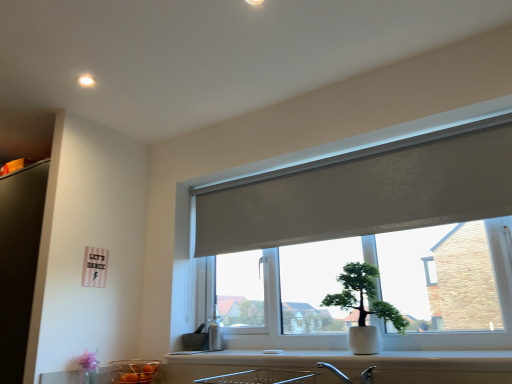
Image resolution: width=512 pixels, height=384 pixels. I want to click on white ceramic pot at center, so click(364, 307).

Describe the element at coordinates (364, 307) in the screenshot. This screenshot has width=512, height=384. I see `white ceramic pot at center` at that location.

This screenshot has height=384, width=512. I want to click on white ceramic pot at center, so click(x=364, y=307).

Is matte gray roller blind at center located within translucent glass bowl at lower left?

Definitely not — matte gray roller blind at center is not inside translucent glass bowl at lower left.

Looking at the image, does translucent glass bowl at lower left seem bigger or smaller compared to matte gray roller blind at center?

Clearly, translucent glass bowl at lower left is smaller in size than matte gray roller blind at center.

Consider the image. Is translucent glass bowl at lower left looking in the opposite direction of matte gray roller blind at center?

No, matte gray roller blind at center is not at the back of translucent glass bowl at lower left.

What's the angular difference between translucent glass bowl at lower left and matte gray roller blind at center's facing directions?

translucent glass bowl at lower left and matte gray roller blind at center are facing 0.0002 degrees away from each other.

Is matte gray roller blind at center at the right side of translucent glass bowl at lower left?

Indeed, matte gray roller blind at center is positioned on the right side of translucent glass bowl at lower left.

Where is `window in front of the translucent glass bowl at lower left`? window in front of the translucent glass bowl at lower left is located at coordinates (365, 195).

Is matte gray roller blind at center taller or shorter than translucent glass bowl at lower left?

Considering their sizes, matte gray roller blind at center has more height than translucent glass bowl at lower left.

From the image's perspective, which is below, matte gray roller blind at center or white glossy counter top at lower center?

white glossy counter top at lower center appears lower in the image.

How many degrees apart are the facing directions of matte gray roller blind at center and white glossy counter top at lower center?

The angle between the facing direction of matte gray roller blind at center and the facing direction of white glossy counter top at lower center is 0.781 degrees.

Considering the sizes of matte gray roller blind at center and white glossy counter top at lower center in the image, is matte gray roller blind at center wider or thinner than white glossy counter top at lower center?

Considering their sizes, matte gray roller blind at center looks slimmer than white glossy counter top at lower center.

Is point (421, 374) positioned after point (294, 180)?

No, (421, 374) is closer to viewer.

Can you confirm if white glossy counter top at lower center is wider than matte gray roller blind at center?

Yes.

Is white glossy counter top at lower center not close to matte gray roller blind at center?

No, white glossy counter top at lower center is not far away from matte gray roller blind at center.

In the image, there is a matte gray roller blind at center. In order to click on counter top below it (from a real-world perspective) in this screenshot , I will do `click(353, 365)`.

In the image, is white ceramic pot at center positioned in front of or behind white glossy counter top at lower center?

Clearly, white ceramic pot at center is behind white glossy counter top at lower center.

Is white glossy counter top at lower center a part of white ceramic pot at center?

No.

How many degrees apart are the facing directions of white ceramic pot at center and white glossy counter top at lower center?

white ceramic pot at center and white glossy counter top at lower center are facing 0.781 degrees away from each other.

Is white ceramic pot at center directly adjacent to matte gray roller blind at center?

They are not placed beside each other.

How different are the orientations of white ceramic pot at center and matte gray roller blind at center in degrees?

The facing directions of white ceramic pot at center and matte gray roller blind at center are 0.000109 degrees apart.

In terms of size, does white ceramic pot at center appear bigger or smaller than matte gray roller blind at center?

In the image, white ceramic pot at center appears to be smaller than matte gray roller blind at center.

From a real-world perspective, who is located lower, white ceramic pot at center or matte gray roller blind at center?

From a 3D spatial view, white ceramic pot at center is below.

Where is `counter top on the left of white ceramic pot at center`? The width and height of the screenshot is (512, 384). counter top on the left of white ceramic pot at center is located at coordinates (353, 365).

Does white glossy counter top at lower center appear on the left side of white ceramic pot at center?

Yes.

How far apart are white glossy counter top at lower center and white ceramic pot at center?

white glossy counter top at lower center is 27.37 centimeters from white ceramic pot at center.

Considering the positions of point (297, 364) and point (361, 283), is point (297, 364) closer or farther from the camera than point (361, 283)?

Point (297, 364) is positioned farther from the camera compared to point (361, 283).

At what (x,y) coordinates should I click in order to perform the action: click on window in front of the translucent glass bowl at lower left. Please return your answer as a coordinate pair (x, y). The height and width of the screenshot is (384, 512). Looking at the image, I should click on (365, 195).

Locate an element on the screen. This screenshot has height=384, width=512. glass bowl below the matte gray roller blind at center (from the image's perspective) is located at coordinates (133, 371).

Which object lies nearer to the anchor point matte gray roller blind at center, white ceramic pot at center or translucent glass bowl at lower left?

white ceramic pot at center.

Which object lies further to the anchor point white ceramic pot at center, white glossy counter top at lower center or matte gray roller blind at center?

Based on the image, matte gray roller blind at center appears to be further to white ceramic pot at center.

Estimate the real-world distances between objects in this image. Which object is closer to white ceramic pot at center, matte gray roller blind at center or translucent glass bowl at lower left?

Among the two, matte gray roller blind at center is located nearer to white ceramic pot at center.

Based on their spatial positions, is translucent glass bowl at lower left or matte gray roller blind at center closer to white ceramic pot at center?

matte gray roller blind at center.

Looking at the image, which one is located further to translucent glass bowl at lower left, matte gray roller blind at center or white glossy counter top at lower center?

Based on the image, matte gray roller blind at center appears to be further to translucent glass bowl at lower left.

When comparing their distances from matte gray roller blind at center, does translucent glass bowl at lower left or white glossy counter top at lower center seem closer?

white glossy counter top at lower center is closer to matte gray roller blind at center.

From the picture: Estimate the real-world distances between objects in this image. Which object is further from white ceramic pot at center, translucent glass bowl at lower left or white glossy counter top at lower center?

translucent glass bowl at lower left is further to white ceramic pot at center.

When comparing their distances from white glossy counter top at lower center, does white ceramic pot at center or matte gray roller blind at center seem closer?

Among the two, white ceramic pot at center is located nearer to white glossy counter top at lower center.

Locate an element on the screen. Image resolution: width=512 pixels, height=384 pixels. counter top located between translucent glass bowl at lower left and white ceramic pot at center in the left-right direction is located at coordinates (353, 365).

Locate an element on the screen. The image size is (512, 384). counter top situated between translucent glass bowl at lower left and matte gray roller blind at center from left to right is located at coordinates click(x=353, y=365).

Identify the location of houseplant between matte gray roller blind at center and white glossy counter top at lower center vertically. (364, 307).

Image resolution: width=512 pixels, height=384 pixels. In order to click on window situated between translucent glass bowl at lower left and white ceramic pot at center from left to right in this screenshot , I will do `click(365, 195)`.